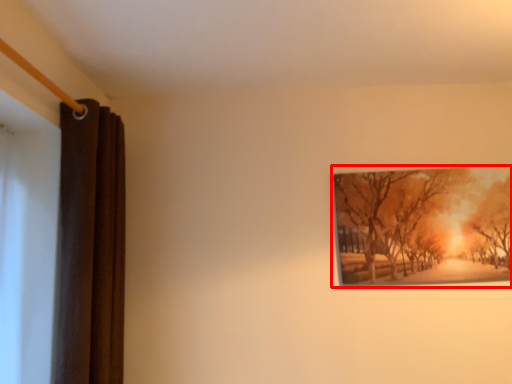
Question: From the image's perspective, what is the correct spatial positioning of picture frame (annotated by the red box) in reference to curtain?

Choices:
 (A) below
 (B) above

Answer: (B)